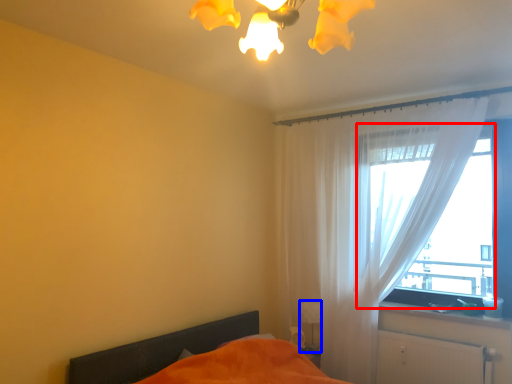
Question: Among these objects, which one is nearest to the camera, window (highlighted by a red box) or table lamp (highlighted by a blue box)?

Choices:
 (A) window
 (B) table lamp

Answer: (A)